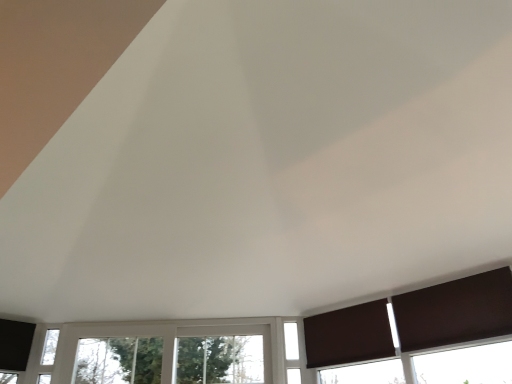
Question: From the image's perspective, is white glass window at center, the 2th window from the left, beneath brown matte curtain at lower right, the 1th curtain when ordered from front to back?

Choices:
 (A) yes
 (B) no

Answer: (A)

Question: Is white glass window at center, the 2th window from the left, oriented towards brown matte curtain at lower right, which ranks as the first curtain in right-to-left order?

Choices:
 (A) yes
 (B) no

Answer: (B)

Question: Considering the relative sizes of white glass window at center, the 2th window from the left, and brown matte curtain at lower right, placed as the second curtain when sorted from back to front, in the image provided, is white glass window at center, the 2th window from the left, smaller than brown matte curtain at lower right, placed as the second curtain when sorted from back to front,?

Choices:
 (A) yes
 (B) no

Answer: (A)

Question: Considering the relative sizes of white glass window at center, which appears as the first window when viewed from the right, and brown matte curtain at lower right, the 2th curtain in the left-to-right sequence, in the image provided, is white glass window at center, which appears as the first window when viewed from the right, bigger than brown matte curtain at lower right, the 2th curtain in the left-to-right sequence,?

Choices:
 (A) yes
 (B) no

Answer: (B)

Question: Does white glass window at center, which appears as the first window when viewed from the right, have a lesser width compared to brown matte curtain at lower right, which ranks as the first curtain in right-to-left order?

Choices:
 (A) no
 (B) yes

Answer: (B)

Question: In the image, is brown matte curtain at lower right, which ranks as the first curtain in right-to-left order, on the left side or the right side of white plastic window at center, placed as the first window when sorted from left to right?

Choices:
 (A) right
 (B) left

Answer: (A)

Question: Looking at their shapes, would you say brown matte curtain at lower right, the 1th curtain when ordered from front to back, is wider or thinner than white plastic window at center, marked as the second window in a right-to-left arrangement?

Choices:
 (A) wide
 (B) thin

Answer: (B)

Question: Is point (481, 294) closer or farther from the camera than point (153, 377)?

Choices:
 (A) farther
 (B) closer

Answer: (B)

Question: From a real-world perspective, is brown matte curtain at lower right, the 2th curtain in the left-to-right sequence, above or below white plastic window at center, placed as the first window when sorted from left to right?

Choices:
 (A) above
 (B) below

Answer: (A)

Question: Which is correct: brown matte curtain at lower right, the 1th curtain when ordered from front to back, is inside brown matte curtain at lower right, the 2th curtain from the right, or outside of it?

Choices:
 (A) outside
 (B) inside

Answer: (A)

Question: Considering the positions of brown matte curtain at lower right, the 2th curtain in the left-to-right sequence, and brown matte curtain at lower right, arranged as the first curtain when viewed from the left, in the image, is brown matte curtain at lower right, the 2th curtain in the left-to-right sequence, wider or thinner than brown matte curtain at lower right, arranged as the first curtain when viewed from the left,?

Choices:
 (A) wide
 (B) thin

Answer: (A)

Question: From the image's perspective, relative to brown matte curtain at lower right, arranged as the first curtain when viewed from the left, is brown matte curtain at lower right, which ranks as the first curtain in right-to-left order, above or below?

Choices:
 (A) above
 (B) below

Answer: (A)

Question: Relative to brown matte curtain at lower right, arranged as the first curtain when viewed from the left, is brown matte curtain at lower right, which ranks as the first curtain in right-to-left order, in front or behind?

Choices:
 (A) front
 (B) behind

Answer: (A)

Question: From a real-world perspective, relative to brown matte curtain at lower right, which is the 2th curtain from front to back, is white plastic window at center, placed as the first window when sorted from left to right, vertically above or below?

Choices:
 (A) below
 (B) above

Answer: (A)

Question: Looking at their shapes, would you say white plastic window at center, placed as the first window when sorted from left to right, is wider or thinner than brown matte curtain at lower right, the 2th curtain from the right?

Choices:
 (A) thin
 (B) wide

Answer: (B)